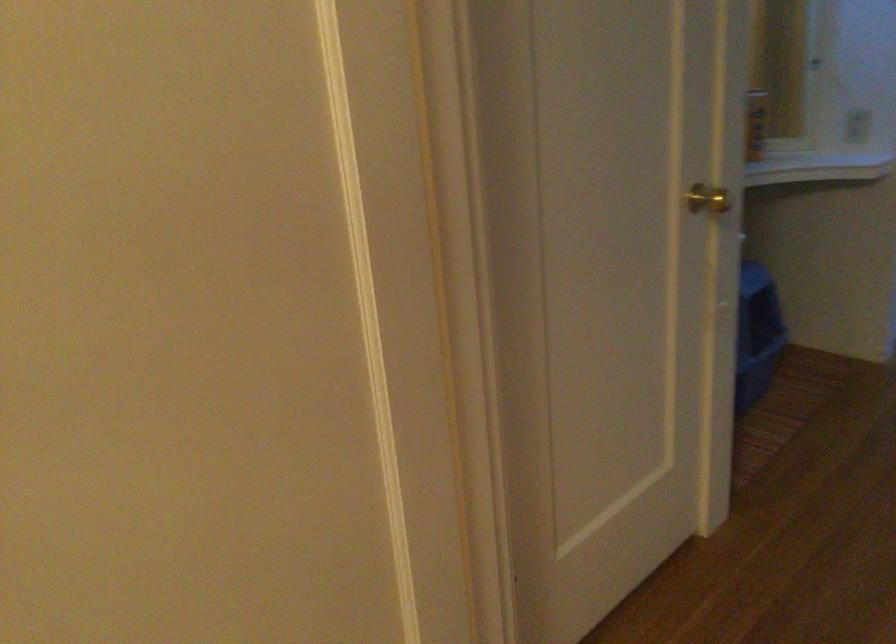
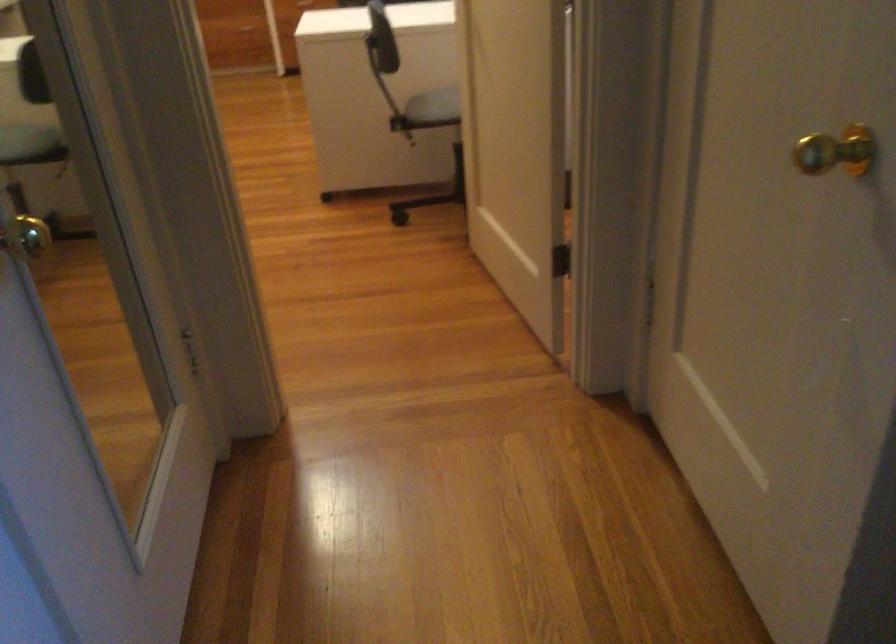
Locate, in the second image, the point that corresponds to (x=700, y=210) in the first image.

(836, 152)